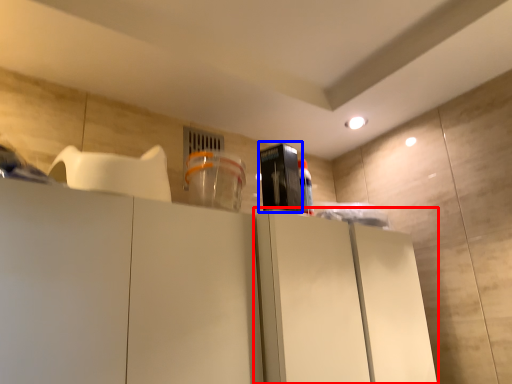
Question: Among these objects, which one is nearest to the camera, cabinetry (highlighted by a red box) or appliance (highlighted by a blue box)?

Choices:
 (A) cabinetry
 (B) appliance

Answer: (A)